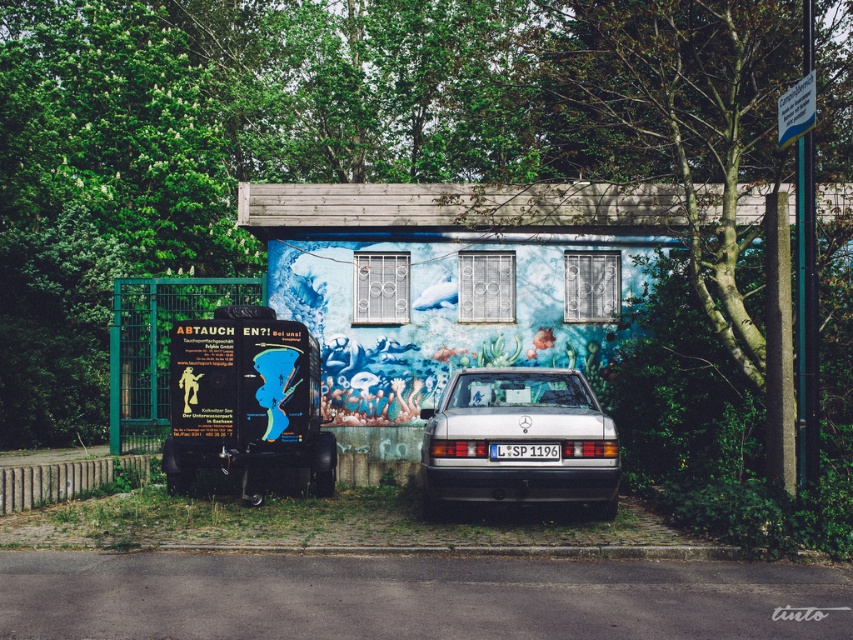
You are standing next to a camera and want to take a photo of the silver metallic car at center. The camera has a maximum focus range of 10 meters. Will you be able to capture the car clearly?

The silver metallic car at center and camera are 9.91 meters apart, so yes, the camera can focus on the silver metallic car at center since it is within the 10 meter range.

Consider the image. You are a delivery driver who needs to park your vehicle in front of the building with the underwater mural. The parking spot is marked by a point at coordinates point (519, 440). Can you safely park your vehicle in that spot without hitting the silver Mercedes at center?

The point (519, 440) is on the silver metallic car at center, so parking there would mean your vehicle would be directly on top of the silver Mercedes at center, causing a collision. Choose another spot.

You are a delivery driver who needs to park your truck in the parking lot next to the building with the blue mural. The truck requires a parking space that can accommodate vehicles larger than the silver metallic car at center. Is the parking space next to the white plastic license plate at center suitable?

The silver metallic car at center has a larger size compared to the white plastic license plate at center. Since the truck needs a space for vehicles larger than the silver metallic car at center, the parking space next to the white plastic license plate at center may not be suitable as it is smaller than the car.